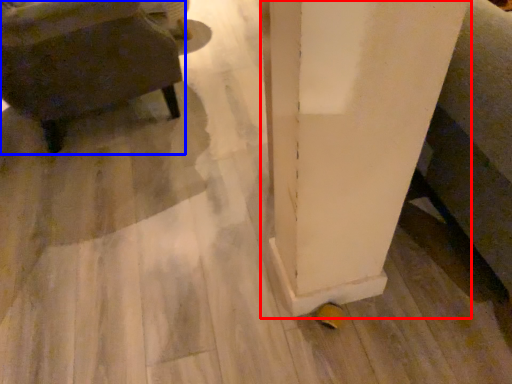
Question: Which of the following is the closest to the observer, pillar (highlighted by a red box) or furniture (highlighted by a blue box)?

Choices:
 (A) pillar
 (B) furniture

Answer: (A)